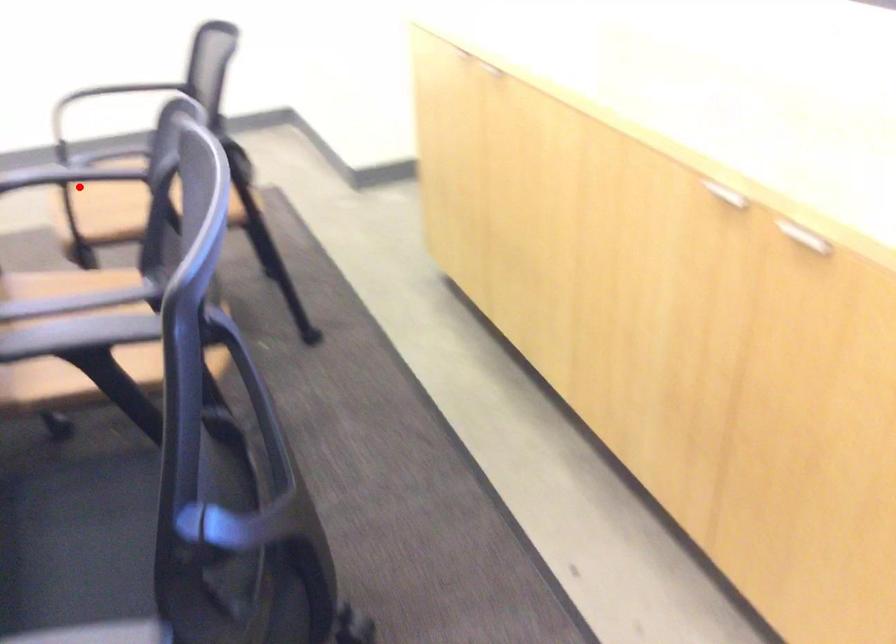
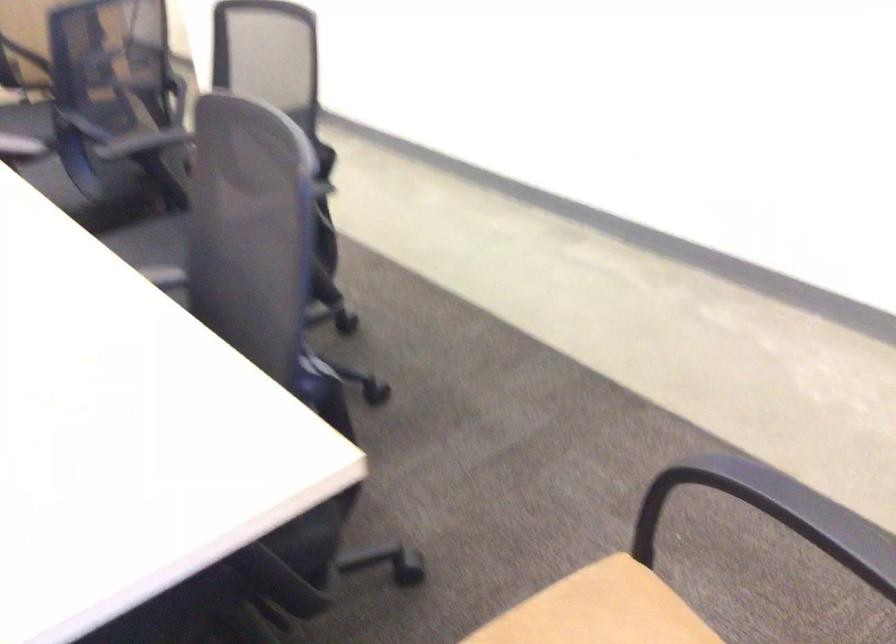
Question: I am providing you with two images of the same scene from different viewpoints. Given a red point in image1, look at the same physical point in image2. Is it:

Choices:
 (A) Closer to the viewpoint
 (B) Farther from the viewpoint

Answer: (A)